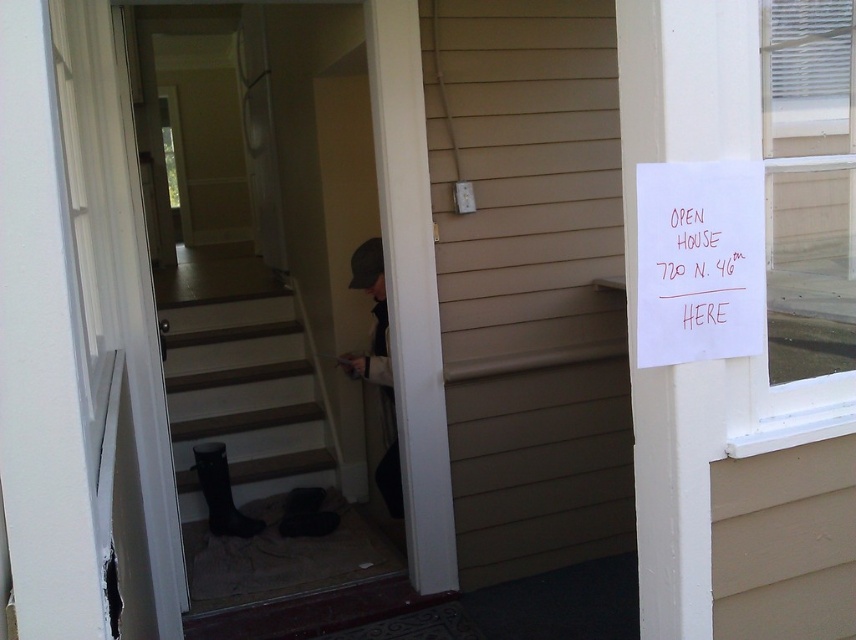
Where is `white paper at upper right`? This screenshot has height=640, width=856. white paper at upper right is located at coordinates (699, 260).

Who is more distant from viewer, (718,246) or (383,296)?

Point (383,296)

Where is `white paper at upper right`? The image size is (856, 640). white paper at upper right is located at coordinates (699, 260).

Is black rubber stair at lower left wider than red paper sign at upper right?

Yes, black rubber stair at lower left is wider than red paper sign at upper right.

Between black rubber stair at lower left and red paper sign at upper right, which one is positioned higher?

red paper sign at upper right

Who is more forward, (235, 397) or (750, 273)?

Point (750, 273) is in front.

Where is `black rubber stair at lower left`? Image resolution: width=856 pixels, height=640 pixels. black rubber stair at lower left is located at coordinates (245, 397).

Which is behind, point (648, 323) or point (396, 508)?

The point (396, 508) is behind.

The width and height of the screenshot is (856, 640). Find the location of `red paper sign at upper right`. red paper sign at upper right is located at coordinates (697, 264).